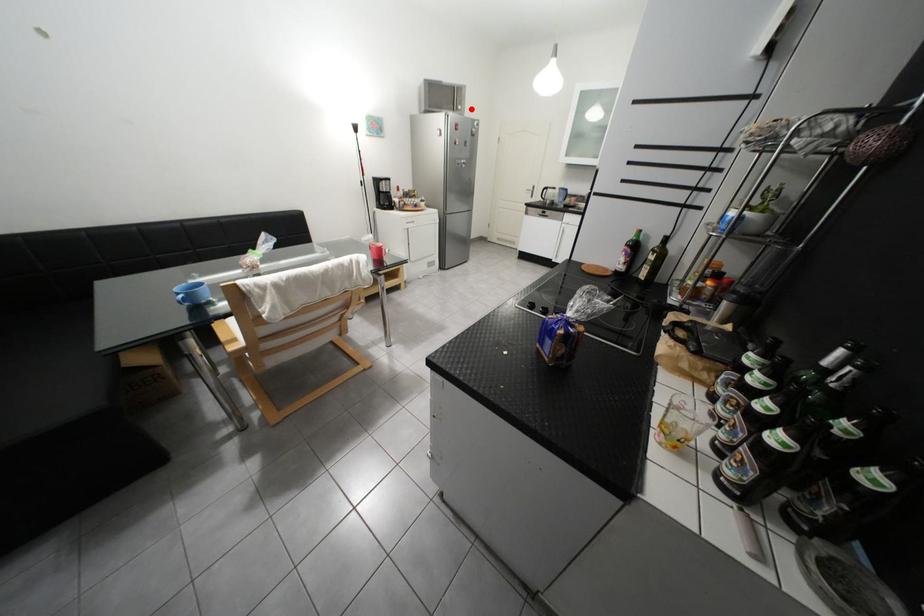
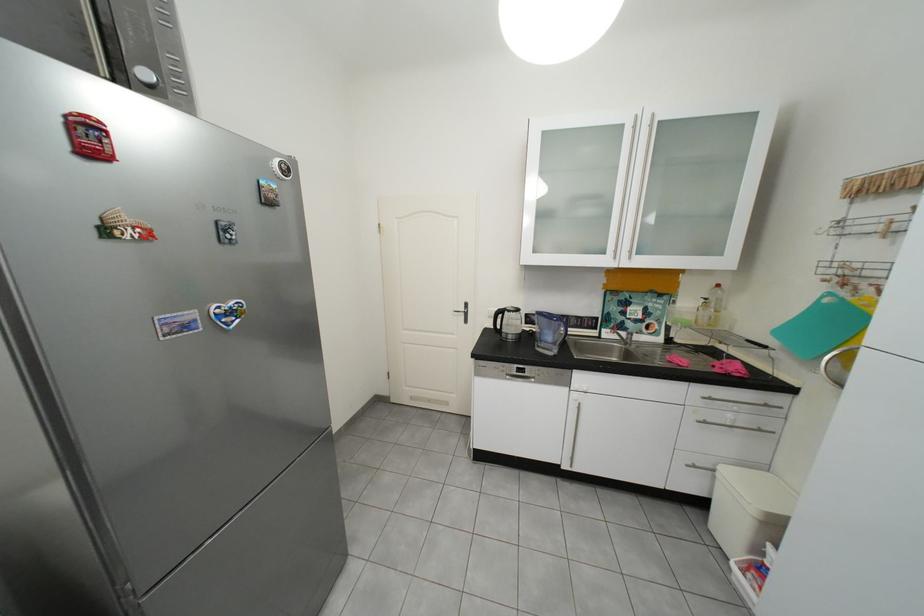
Find the pixel in the second image that matches the highlighted location in the first image.

(156, 75)